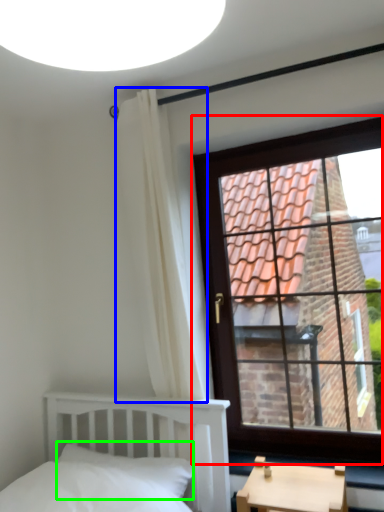
Question: Estimate the real-world distances between objects in this image. Which object is closer to window (highlighted by a red box), curtain (highlighted by a blue box) or pillow (highlighted by a green box)?

Choices:
 (A) curtain
 (B) pillow

Answer: (A)